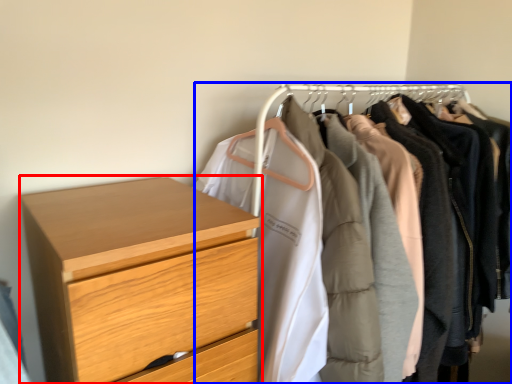
Question: Among these objects, which one is nearest to the camera, chest of drawers (highlighted by a red box) or closet (highlighted by a blue box)?

Choices:
 (A) chest of drawers
 (B) closet

Answer: (A)